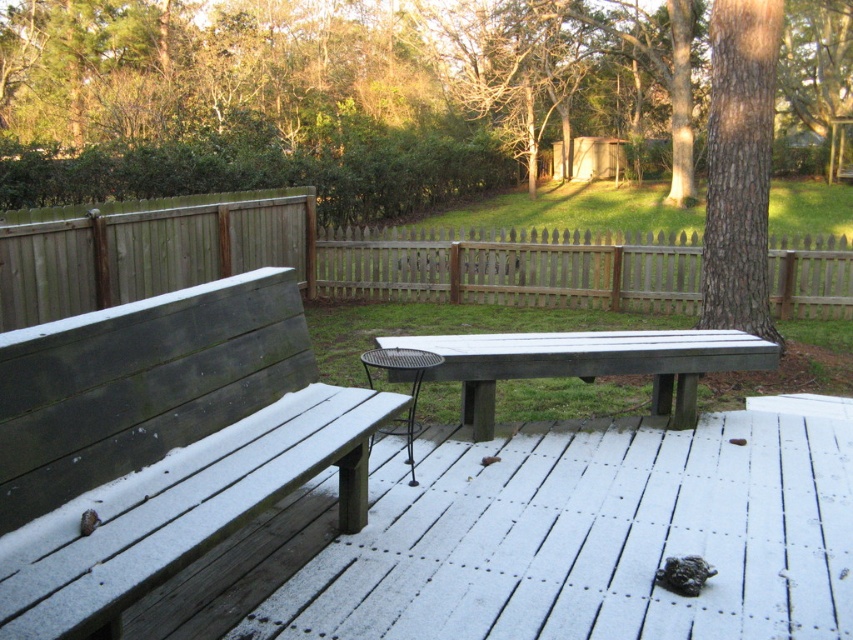
Is point (78, 547) closer to viewer compared to point (692, 387)?

Yes.

Is point (224, 337) behind point (697, 339)?

No, (224, 337) is in front of (697, 339).

Identify the location of wooden bench at left. (160, 444).

Image resolution: width=853 pixels, height=640 pixels. Find the location of `wooden bench at left`. wooden bench at left is located at coordinates (160, 444).

Does wooden bench at left have a greater height compared to weathered wood fence at center?

No, wooden bench at left is not taller than weathered wood fence at center.

Is point (73, 417) positioned after point (846, 285)?

No.

Locate an element on the screen. wooden bench at left is located at coordinates (160, 444).

How far apart are weathered wood fence at center and wooden picket fence at center?

weathered wood fence at center and wooden picket fence at center are 8.77 feet apart from each other.

Which is above, weathered wood fence at center or wooden picket fence at center?

weathered wood fence at center is above.

Which is behind, point (604, 269) or point (582, 266)?

Positioned behind is point (582, 266).

Image resolution: width=853 pixels, height=640 pixels. Find the location of `weathered wood fence at center`. weathered wood fence at center is located at coordinates (325, 259).